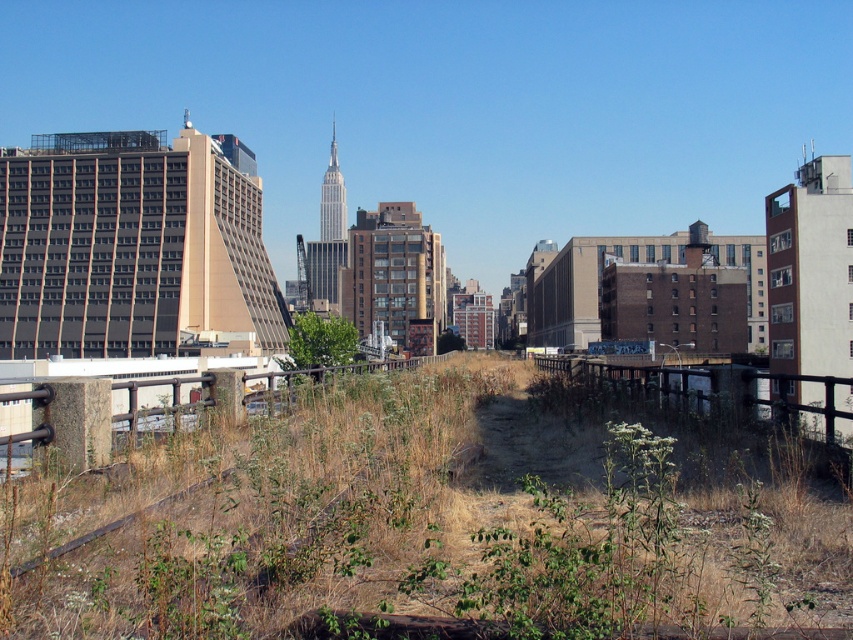
Can you confirm if dry grass at center is shorter than green leafy tree at center?

Correct, dry grass at center is not as tall as green leafy tree at center.

Which of these two, dry grass at center or green leafy tree at center, stands taller?

green leafy tree at center

In order to click on dry grass at center in this screenshot , I will do `click(418, 529)`.